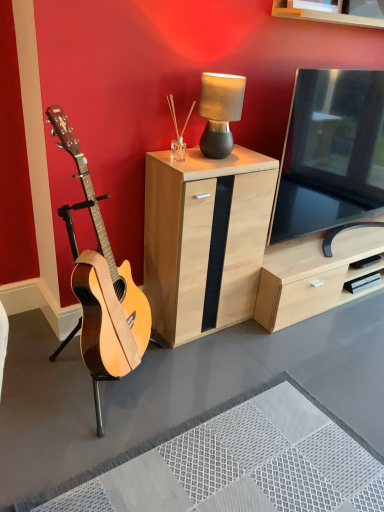
Question: Would you say black glossy tv at right is inside or outside natural wood guitar at left?

Choices:
 (A) inside
 (B) outside

Answer: (B)

Question: Is black glossy tv at right in front of or behind natural wood guitar at left in the image?

Choices:
 (A) front
 (B) behind

Answer: (B)

Question: Which object is positioned farthest from the natural wood guitar at left?

Choices:
 (A) black glossy tv at right
 (B) matte black lamp at upper center
 (C) light wood/black panel cabinet at center

Answer: (A)

Question: Which of these objects is positioned farthest from the light wood/black panel cabinet at center?

Choices:
 (A) black glossy tv at right
 (B) matte black lamp at upper center
 (C) natural wood guitar at left

Answer: (A)